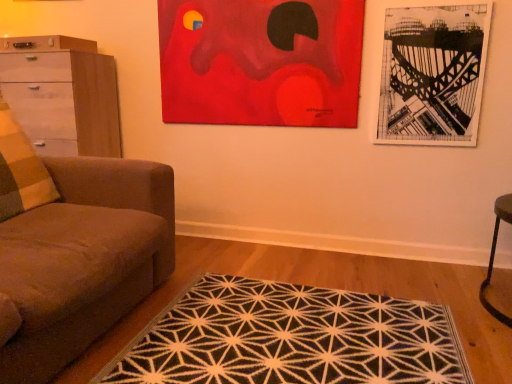
Question: From a real-world perspective, is red acrylic painting at upper center, which is counted as the 2th picture frame, starting from the right, on white glossy chest of drawers at left?

Choices:
 (A) no
 (B) yes

Answer: (B)

Question: From a real-world perspective, is red acrylic painting at upper center, which is the first picture frame in left-to-right order, physically below white glossy chest of drawers at left?

Choices:
 (A) no
 (B) yes

Answer: (A)

Question: Does red acrylic painting at upper center, which is the first picture frame in left-to-right order, have a greater width compared to white glossy chest of drawers at left?

Choices:
 (A) yes
 (B) no

Answer: (B)

Question: Is red acrylic painting at upper center, which is the first picture frame in left-to-right order, facing away from white glossy chest of drawers at left?

Choices:
 (A) yes
 (B) no

Answer: (B)

Question: Is red acrylic painting at upper center, which is counted as the 2th picture frame, starting from the right, further to camera compared to white glossy chest of drawers at left?

Choices:
 (A) yes
 (B) no

Answer: (B)

Question: Considering the relative positions of red acrylic painting at upper center, which is the first picture frame in left-to-right order, and white glossy chest of drawers at left in the image provided, is red acrylic painting at upper center, which is the first picture frame in left-to-right order, to the left of white glossy chest of drawers at left from the viewer's perspective?

Choices:
 (A) no
 (B) yes

Answer: (A)

Question: Is red acrylic painting at upper center, which is counted as the 2th picture frame, starting from the right, facing towards black paper picture frame at upper right, acting as the first picture frame starting from the right?

Choices:
 (A) yes
 (B) no

Answer: (B)

Question: From a real-world perspective, is red acrylic painting at upper center, which is counted as the 2th picture frame, starting from the right, located higher than black paper picture frame at upper right, acting as the first picture frame starting from the right?

Choices:
 (A) yes
 (B) no

Answer: (A)

Question: Considering the relative sizes of red acrylic painting at upper center, which is counted as the 2th picture frame, starting from the right, and black paper picture frame at upper right, acting as the first picture frame starting from the right, in the image provided, is red acrylic painting at upper center, which is counted as the 2th picture frame, starting from the right, bigger than black paper picture frame at upper right, acting as the first picture frame starting from the right,?

Choices:
 (A) yes
 (B) no

Answer: (A)

Question: From the image's perspective, is red acrylic painting at upper center, which is counted as the 2th picture frame, starting from the right, below black paper picture frame at upper right, acting as the first picture frame starting from the right?

Choices:
 (A) yes
 (B) no

Answer: (B)

Question: Is red acrylic painting at upper center, which is the first picture frame in left-to-right order, located outside black paper picture frame at upper right, acting as the first picture frame starting from the right?

Choices:
 (A) no
 (B) yes

Answer: (B)

Question: Does red acrylic painting at upper center, which is the first picture frame in left-to-right order, appear on the right side of black paper picture frame at upper right, which ranks as the 2th picture frame in left-to-right order?

Choices:
 (A) no
 (B) yes

Answer: (A)

Question: Is black paper picture frame at upper right, acting as the first picture frame starting from the right, further to camera compared to brown fabric couch at left?

Choices:
 (A) yes
 (B) no

Answer: (A)